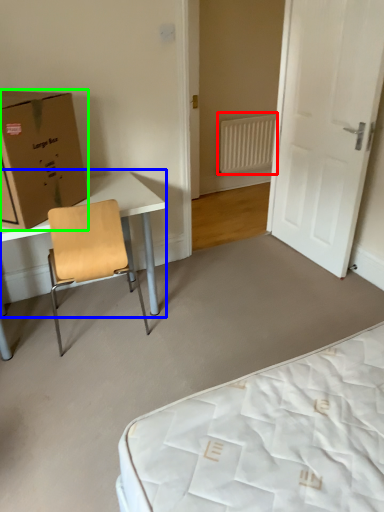
Question: Which is nearer to the radiator (highlighted by a red box)? table (highlighted by a blue box) or box (highlighted by a green box).

Choices:
 (A) table
 (B) box

Answer: (A)